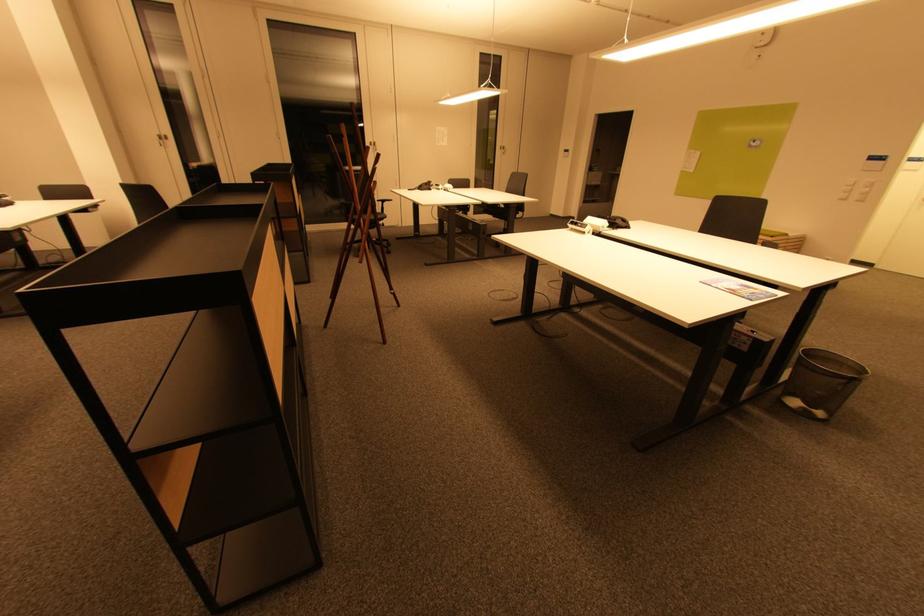
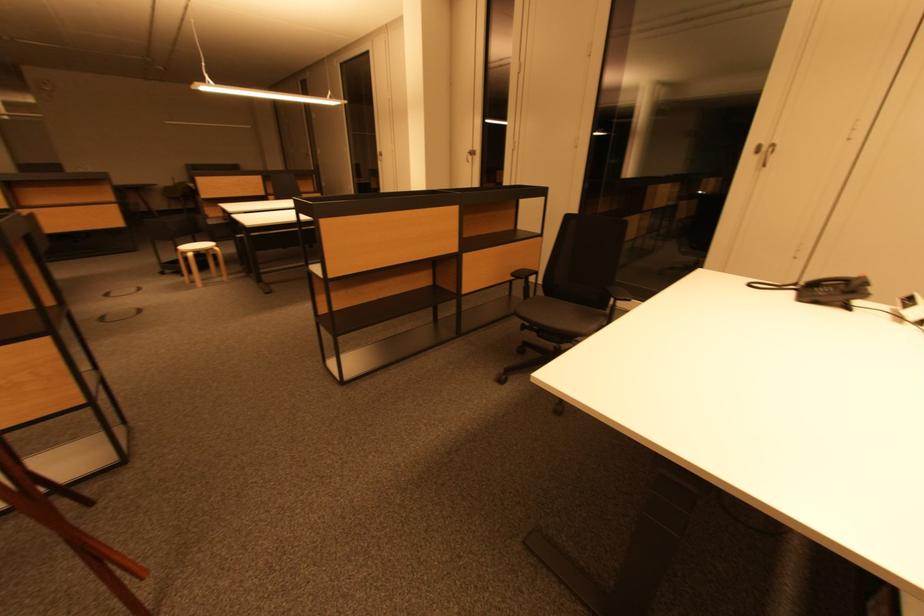
Where in the second image is the point corresponding to point 378,146 from the first image?

(767, 150)